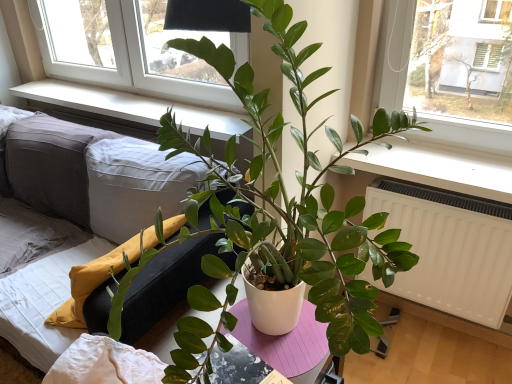
Question: Should I look upward or downward to see white matte radiator at lower right?

Choices:
 (A) up
 (B) down

Answer: (B)

Question: Can you confirm if white smooth window sill at upper center is thinner than gray fabric couch at center?

Choices:
 (A) yes
 (B) no

Answer: (A)

Question: Would you consider white smooth window sill at upper center to be distant from gray fabric couch at center?

Choices:
 (A) yes
 (B) no

Answer: (B)

Question: Is white smooth window sill at upper center not within gray fabric couch at center?

Choices:
 (A) yes
 (B) no

Answer: (A)

Question: Is gray fabric couch at center inside white smooth window sill at upper center?

Choices:
 (A) yes
 (B) no

Answer: (B)

Question: Does white smooth window sill at upper center turn towards gray fabric couch at center?

Choices:
 (A) no
 (B) yes

Answer: (A)

Question: From a real-world perspective, is white smooth window sill at upper center under gray fabric couch at center?

Choices:
 (A) yes
 (B) no

Answer: (B)

Question: Is the depth of gray fabric couch at center greater than that of white matte radiator at lower right?

Choices:
 (A) yes
 (B) no

Answer: (B)

Question: Does gray fabric couch at center have a larger size compared to white matte radiator at lower right?

Choices:
 (A) no
 (B) yes

Answer: (B)

Question: Does gray fabric couch at center appear on the right side of white matte radiator at lower right?

Choices:
 (A) yes
 (B) no

Answer: (B)

Question: Can you confirm if gray fabric couch at center is wider than white matte radiator at lower right?

Choices:
 (A) yes
 (B) no

Answer: (A)

Question: Is the surface of gray fabric couch at center in direct contact with white matte radiator at lower right?

Choices:
 (A) yes
 (B) no

Answer: (B)

Question: Is white matte radiator at lower right surrounded by gray fabric couch at center?

Choices:
 (A) yes
 (B) no

Answer: (B)

Question: Is white smooth window sill at upper center aimed at white matte pot at center?

Choices:
 (A) yes
 (B) no

Answer: (B)